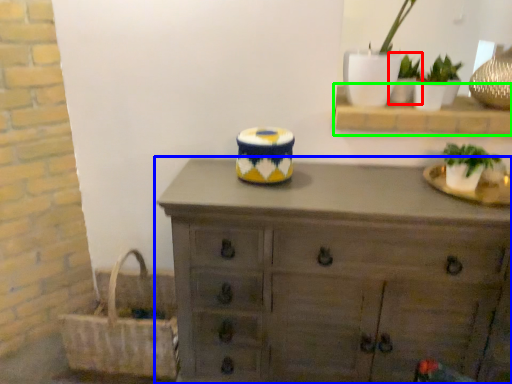
Question: Estimate the real-world distances between objects in this image. Which object is farther from houseplant (highlighted by a red box), chest of drawers (highlighted by a blue box) or shelf (highlighted by a green box)?

Choices:
 (A) chest of drawers
 (B) shelf

Answer: (A)